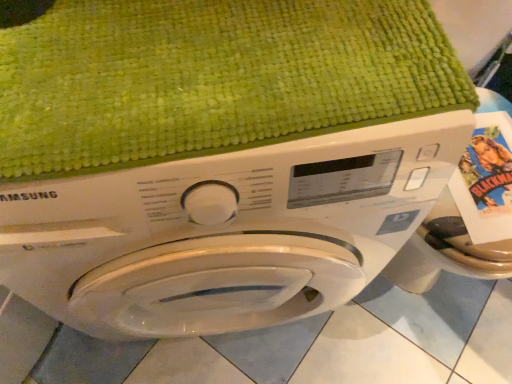
Question: Looking at the image, does white glossy washing machine at center seem bigger or smaller compared to green textured bath towel at upper center?

Choices:
 (A) small
 (B) big

Answer: (B)

Question: Considering the positions of white glossy washing machine at center and green textured bath towel at upper center in the image, is white glossy washing machine at center taller or shorter than green textured bath towel at upper center?

Choices:
 (A) short
 (B) tall

Answer: (B)

Question: In terms of width, does white glossy washing machine at center look wider or thinner when compared to green textured bath towel at upper center?

Choices:
 (A) wide
 (B) thin

Answer: (A)

Question: Relative to white glossy washing machine at center, is green textured bath towel at upper center in front or behind?

Choices:
 (A) behind
 (B) front

Answer: (A)

Question: Is green textured bath towel at upper center spatially inside white glossy washing machine at center, or outside of it?

Choices:
 (A) inside
 (B) outside

Answer: (A)

Question: Visually, is green textured bath towel at upper center positioned to the left or to the right of white glossy washing machine at center?

Choices:
 (A) left
 (B) right

Answer: (B)

Question: Considering the positions of green textured bath towel at upper center and white glossy washing machine at center in the image, is green textured bath towel at upper center taller or shorter than white glossy washing machine at center?

Choices:
 (A) tall
 (B) short

Answer: (B)